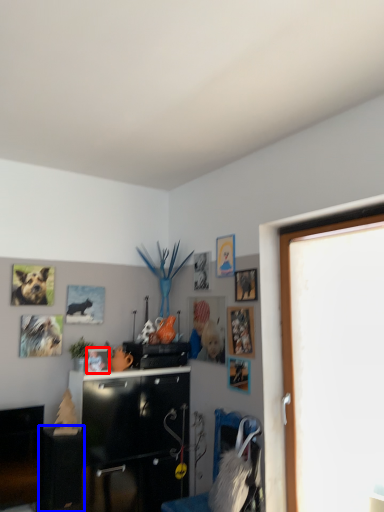
Question: Which of the following is the closest to the observer, picture frame (highlighted by a red box) or table (highlighted by a blue box)?

Choices:
 (A) picture frame
 (B) table

Answer: (B)